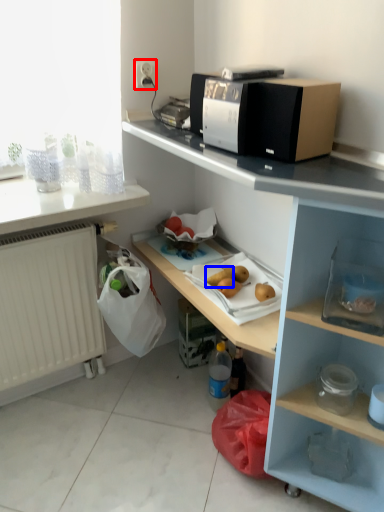
Question: Among these objects, which one is farthest to the camera, electric outlet (highlighted by a red box) or fruit (highlighted by a blue box)?

Choices:
 (A) electric outlet
 (B) fruit

Answer: (A)